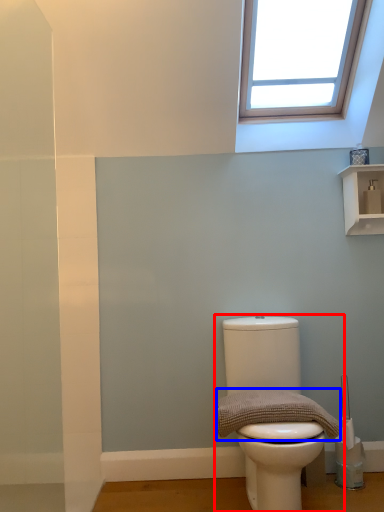
Question: Which of the following is the farthest to the observer, toilet (highlighted by a red box) or material (highlighted by a blue box)?

Choices:
 (A) toilet
 (B) material

Answer: (B)